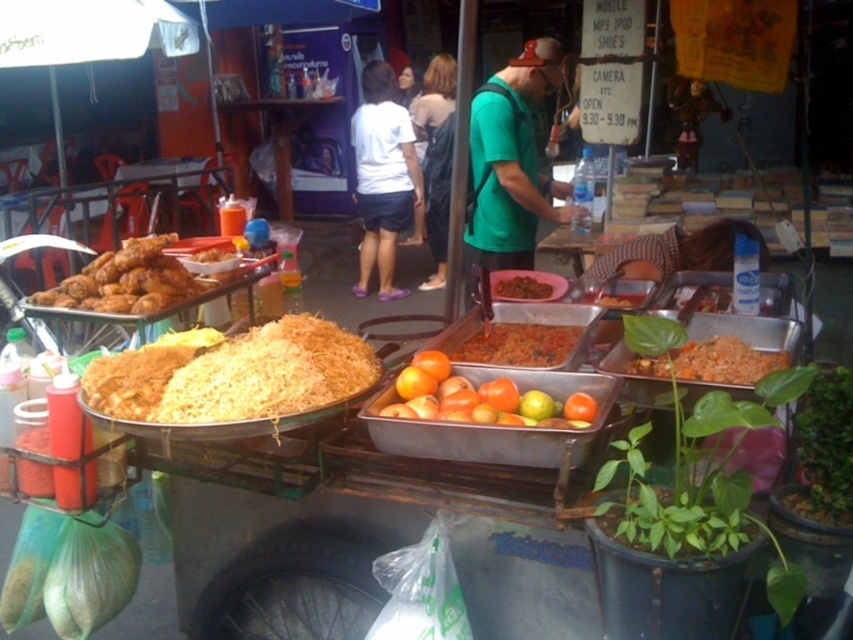
You are a customer at the food cart and want to grab the yellow fried rice at center without touching the white matte shirt at center. Is this possible?

The yellow fried rice at center is located below the white matte shirt at center, so you can reach it without touching the shirt by moving your hand underneath.